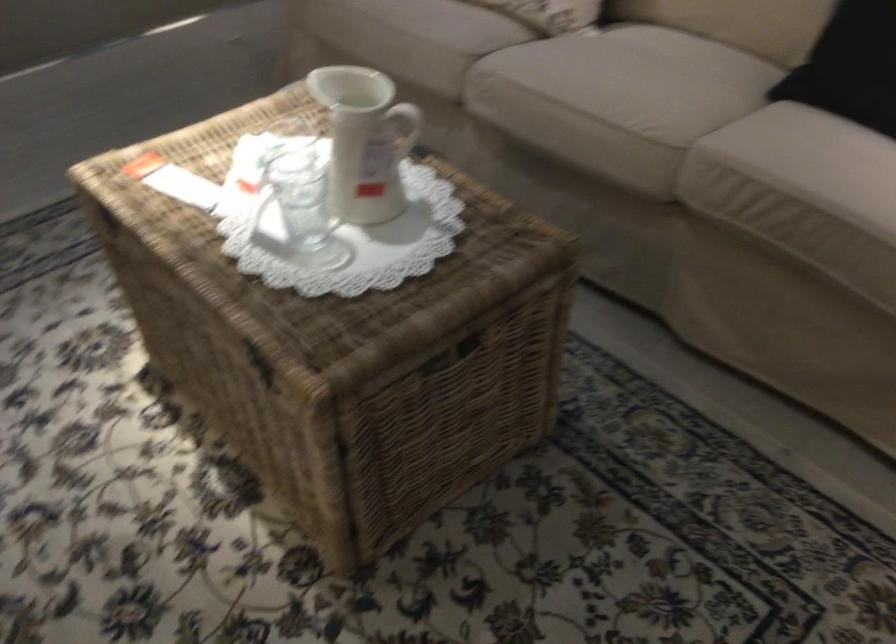
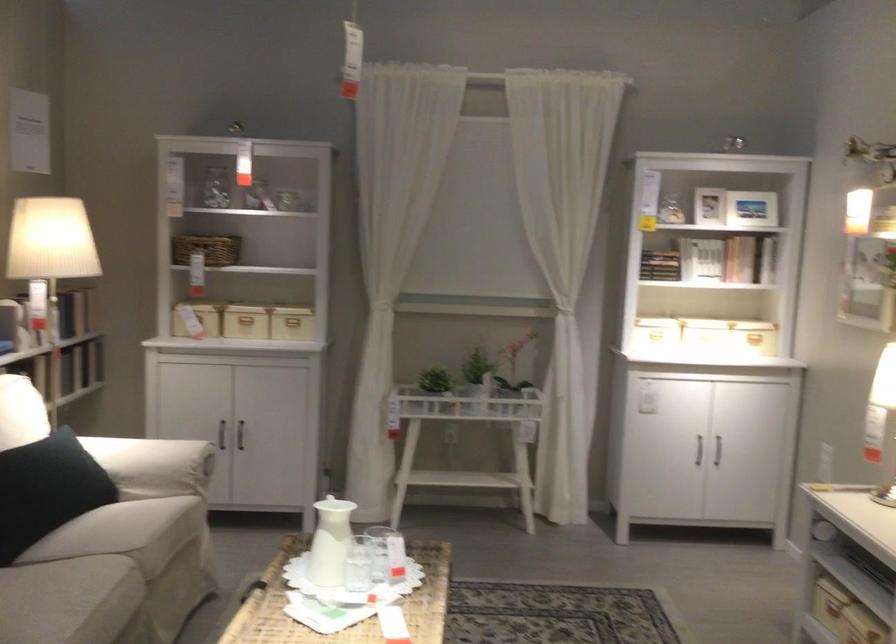
Where in the second image is the point corresponding to (x=313, y=218) from the first image?

(386, 554)